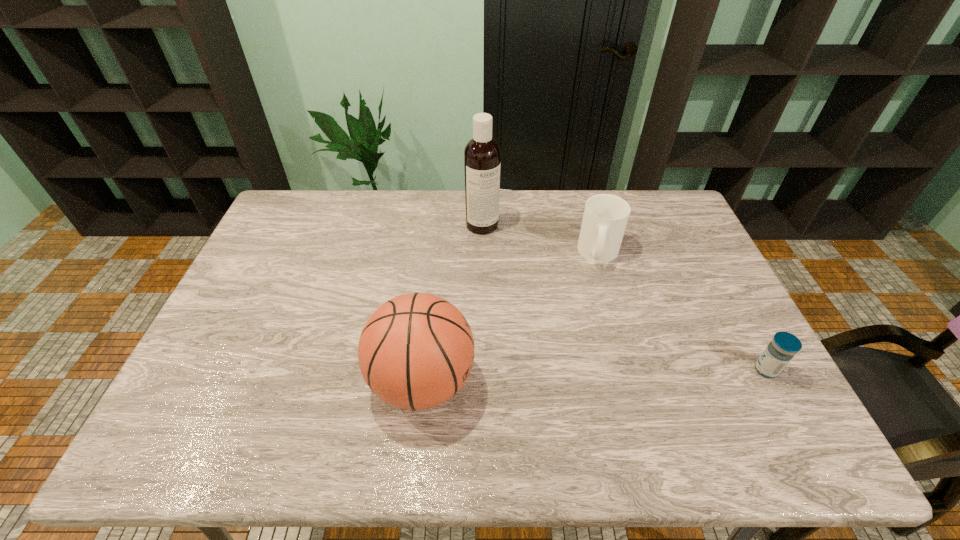
Identify the location of free space between the farthest object and the basketball. (452, 303).

The image size is (960, 540). Find the location of `vacant space that's between the medicine and the second shortest object`. vacant space that's between the medicine and the second shortest object is located at coordinates (683, 312).

This screenshot has width=960, height=540. In order to click on free space between the farthest object and the medicine in this screenshot , I will do `click(624, 298)`.

Locate an element on the screen. free area in between the second farthest object and the basketball is located at coordinates (511, 318).

Where is `the closest object to the medicine`? Image resolution: width=960 pixels, height=540 pixels. the closest object to the medicine is located at coordinates (605, 217).

Identify which object is the second closest to the third nearest object. Please provide its 2D coordinates. Your answer should be formatted as a tuple, i.e. [(x, y)], where the tuple contains the x and y coordinates of a point satisfying the conditions above.

[(784, 345)]

The image size is (960, 540). What are the coordinates of `free space that satisfies the following two spatial constraints: 1. on the front side of the rightmost object; 2. on the left side of the dishwasher detergent` in the screenshot? It's located at (483, 370).

Where is `vacant space that satisfies the following two spatial constraints: 1. on the front side of the dishwasher detergent; 2. on the left side of the second object from right to left`? Image resolution: width=960 pixels, height=540 pixels. vacant space that satisfies the following two spatial constraints: 1. on the front side of the dishwasher detergent; 2. on the left side of the second object from right to left is located at coordinates (482, 253).